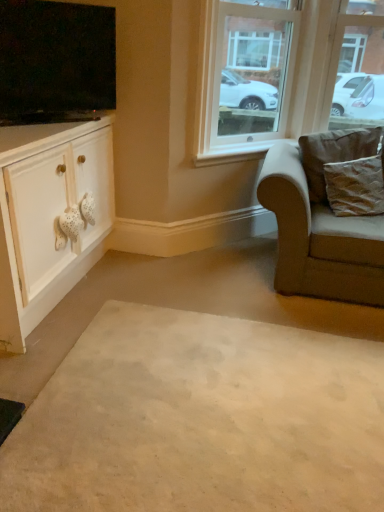
Image resolution: width=384 pixels, height=512 pixels. I want to click on empty space that is ontop of beige carpet at center, so click(x=228, y=428).